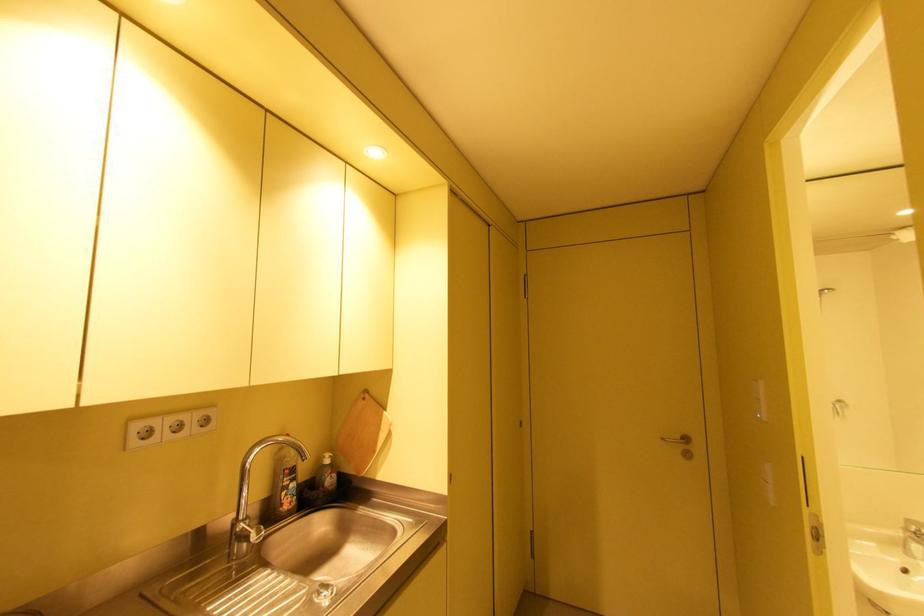
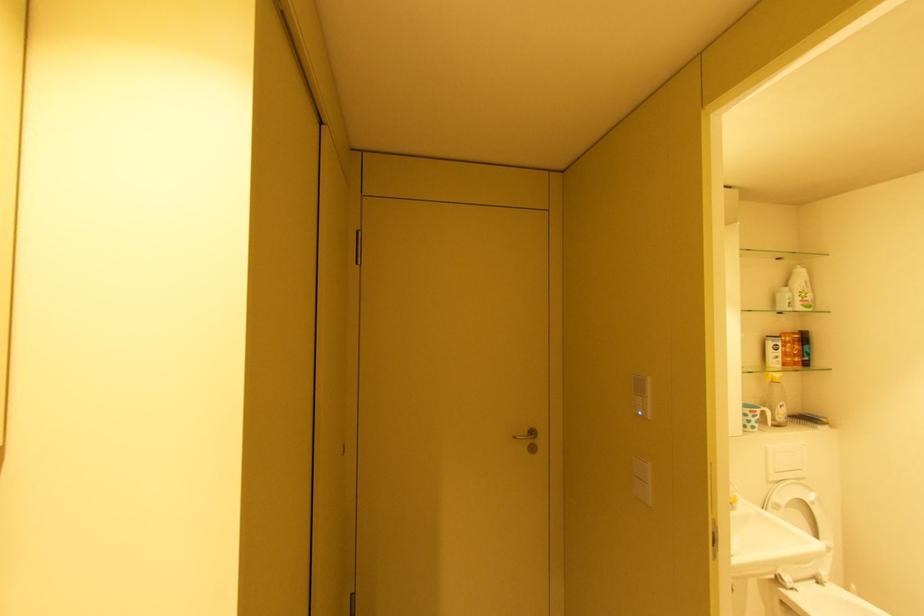
Locate, in the second image, the point that corresponds to point 669,439 in the first image.

(520, 438)